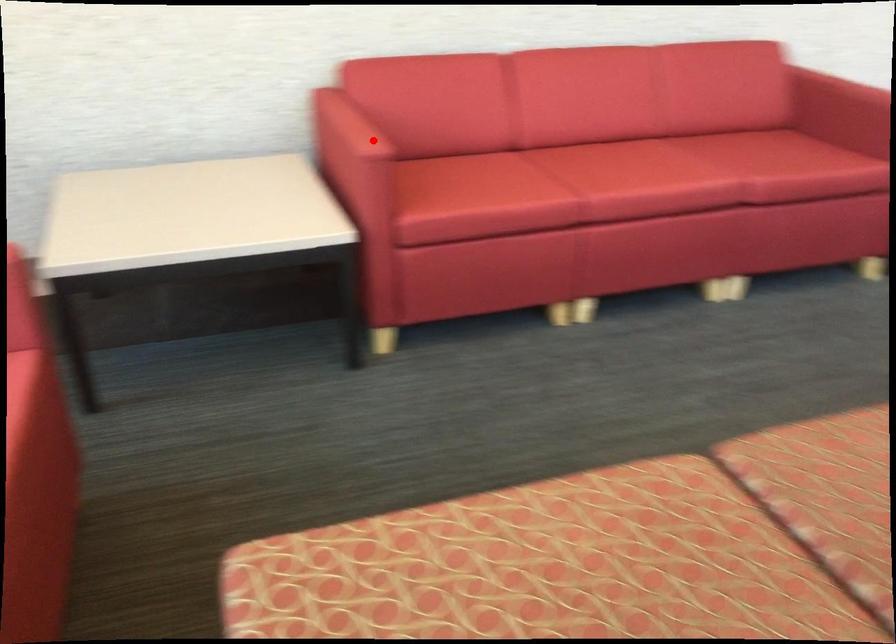
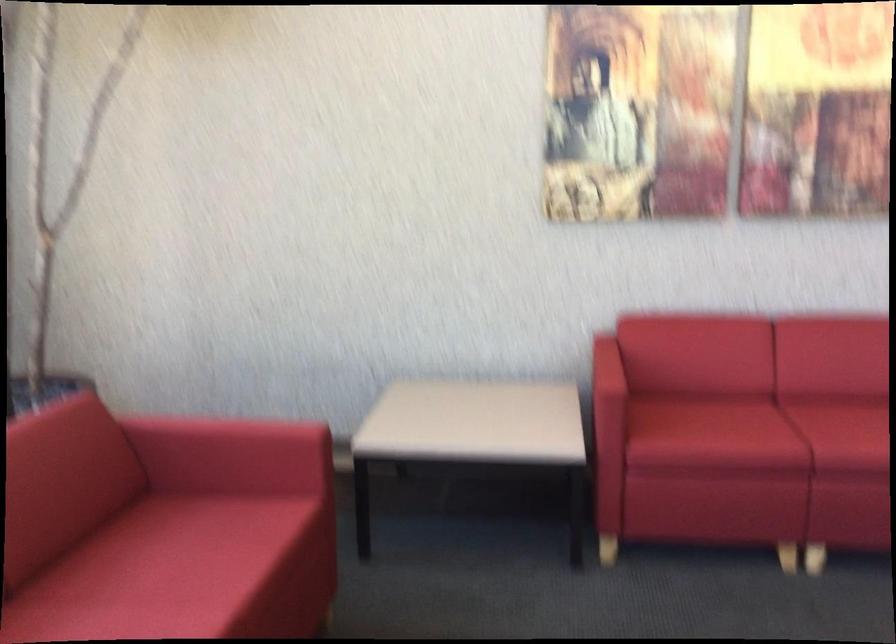
Question: I am providing you with two images of the same scene from different viewpoints. Image1 has a red point marked. In image2, the corresponding 3D location appears at what relative position? Reply with the corresponding letter.

Choices:
 (A) Closer
 (B) Farther

Answer: (B)